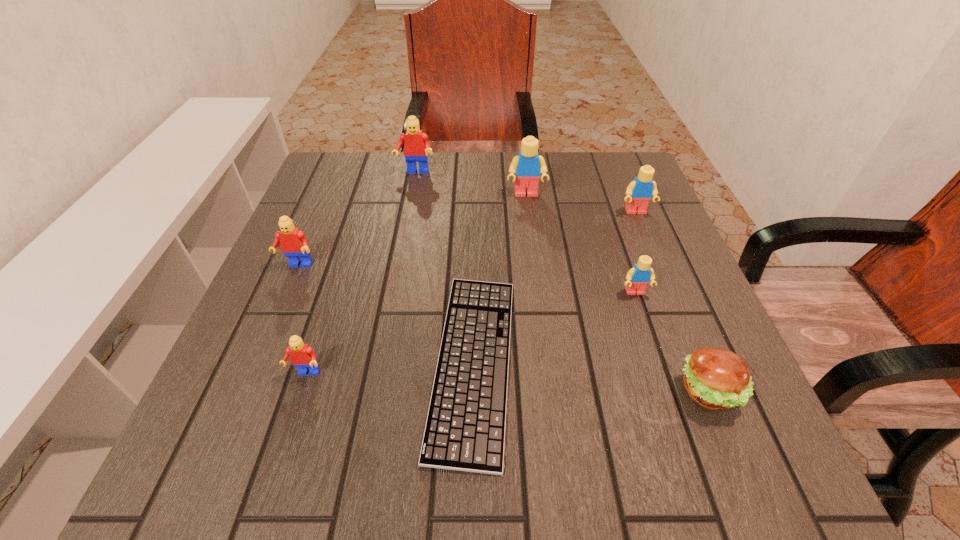
Image resolution: width=960 pixels, height=540 pixels. Identify the location of vacant area that lies between the biggest yellow Lego and the hamburger. coord(617,293).

Where is `vacant point located between the fifth nearest Lego and the smallest yellow Lego`? vacant point located between the fifth nearest Lego and the smallest yellow Lego is located at coordinates (581, 244).

Find the location of a particular element. Image resolution: width=960 pixels, height=540 pixels. vacant space in between the second nearest red Lego and the second biggest yellow Lego is located at coordinates (467, 239).

Find the location of `object identified as the sixth closest to the black computer keyboard`. object identified as the sixth closest to the black computer keyboard is located at coordinates (639, 192).

The image size is (960, 540). Find the location of `object that is the second closest to the biggest yellow Lego`. object that is the second closest to the biggest yellow Lego is located at coordinates (416, 146).

You are a GUI agent. You are given a task and a screenshot of the screen. Output one action in this format:
    pyautogui.click(x=<x>, y=<y>)
    Task: Click on the Lego that is the second closest one to the nearest yellow Lego
    
    Given the screenshot: What is the action you would take?
    pyautogui.click(x=528, y=166)

You are a GUI agent. You are given a task and a screenshot of the screen. Output one action in this format:
    pyautogui.click(x=<x>, y=<y>)
    Task: Click on the Lego that stands as the second closest to the sixth nearest object
    The width and height of the screenshot is (960, 540).
    Given the screenshot: What is the action you would take?
    pyautogui.click(x=638, y=277)

Select which yellow Lego appears as the third closest to the hamburger. Please provide its 2D coordinates. Your answer should be formatted as a tuple, i.e. [(x, y)], where the tuple contains the x and y coordinates of a point satisfying the conditions above.

[(528, 166)]

Locate an element on the screen. the closest yellow Lego relative to the hamburger is located at coordinates (638, 277).

Select which red Lego is the closest to the second nearest yellow Lego. Please provide its 2D coordinates. Your answer should be formatted as a tuple, i.e. [(x, y)], where the tuple contains the x and y coordinates of a point satisfying the conditions above.

[(416, 146)]